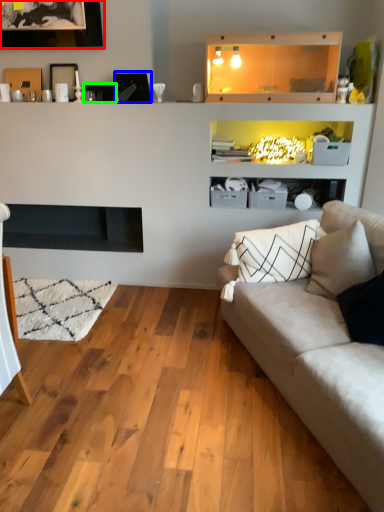
Question: Considering the real-world distances, which object is farthest from picture frame (highlighted by a red box)? picture frame (highlighted by a blue box) or picture frame (highlighted by a green box)?

Choices:
 (A) picture frame
 (B) picture frame

Answer: (A)